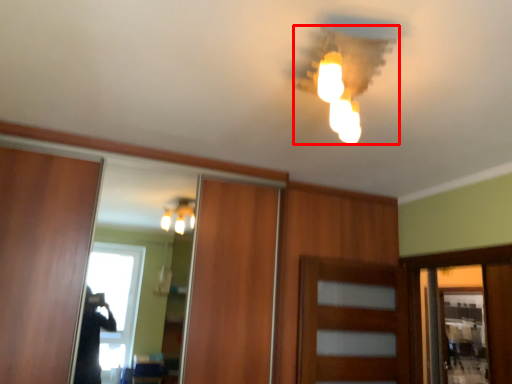
Question: From the image's perspective, where is lamp (annotated by the red box) located relative to door?

Choices:
 (A) above
 (B) below

Answer: (A)